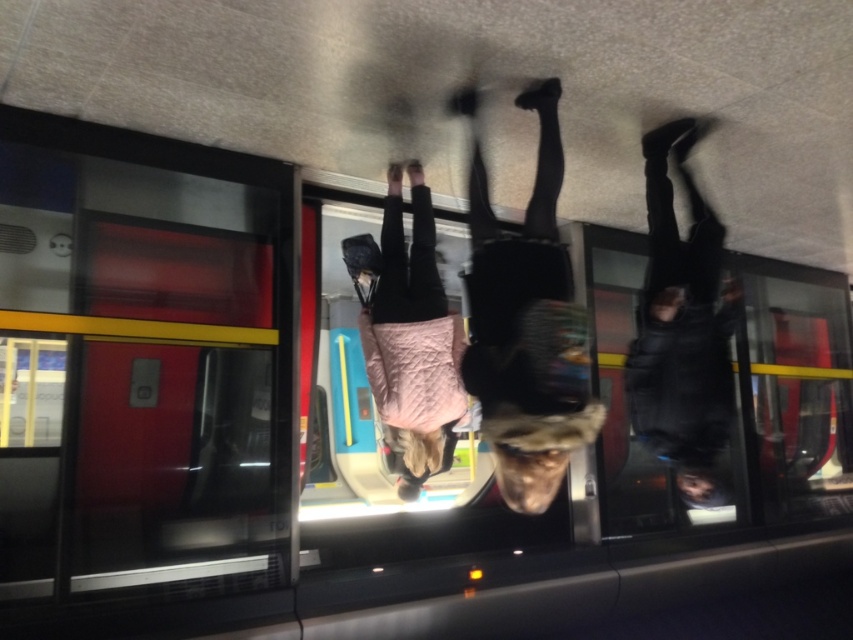
Is the position of black leather pants at upper center less distant than that of pink quilted jacket at center?

Yes, black leather pants at upper center is closer to the viewer.

Consider the image. Is black leather pants at upper center below pink quilted jacket at center?

Incorrect, black leather pants at upper center is not positioned below pink quilted jacket at center.

Who is more distant from viewer, (665,204) or (389,317)?

Point (389,317)

This screenshot has height=640, width=853. I want to click on black leather pants at upper center, so click(682, 324).

Who is positioned more to the left, black leather pants at center or black leather pants at upper center?

Positioned to the left is black leather pants at center.

Is black leather pants at center smaller than black leather pants at upper center?

No.

Which is in front, point (520, 328) or point (630, 358)?

Positioned in front is point (520, 328).

What are the coordinates of `black leather pants at center` in the screenshot? It's located at (526, 323).

At what (x,y) coordinates should I click in order to perform the action: click on black leather pants at center. Please return your answer as a coordinate pair (x, y). The height and width of the screenshot is (640, 853). Looking at the image, I should click on (526, 323).

Can you confirm if black leather pants at center is shorter than pink quilted jacket at center?

No, black leather pants at center is not shorter than pink quilted jacket at center.

Is point (509, 269) positioned before point (436, 292)?

Yes, it is in front of point (436, 292).

This screenshot has height=640, width=853. I want to click on black leather pants at center, so click(526, 323).